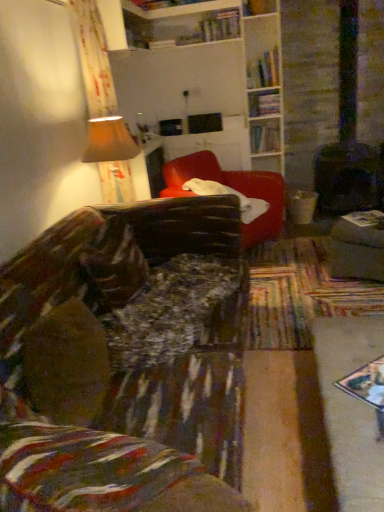
Describe the element at coordinates (264, 103) in the screenshot. I see `wooden bookshelf at upper center, the first shelf viewed from the back` at that location.

The image size is (384, 512). In order to click on hardcover book at upper center, the 2th book in the back-to-front sequence in this screenshot , I will do `click(220, 26)`.

You are a GUI agent. You are given a task and a screenshot of the screen. Output one action in this format:
    pyautogui.click(x=<x>, y=<y>)
    Task: Click on the velvet-like red couch at center, the 1th studio couch when ordered from top to bottom
    The width and height of the screenshot is (384, 512).
    Given the screenshot: What is the action you would take?
    pyautogui.click(x=234, y=189)

Identify the location of velvet-like brown couch at lower left, which ranks as the 1th studio couch in front-to-back order. This screenshot has width=384, height=512. (122, 359).

In order to face wooden bookshelf at upper center, acting as the 2th shelf starting from the back, should I rotate leftwards or rightwards?

It's best to rotate right around 9.214 degrees.

The height and width of the screenshot is (512, 384). What do you see at coordinates (364, 218) in the screenshot?
I see `white paper book at right, the first book when ordered from front to back` at bounding box center [364, 218].

Locate an element on the screen. wooden bookshelf at upper center, the first shelf ordered from the bottom is located at coordinates (264, 103).

Is point (97, 154) closer or farther from the camera than point (367, 213)?

Clearly, point (97, 154) is closer to the camera than point (367, 213).

Does matte beige lampshade at upper left have a lesser height compared to white paper book at right, placed as the 1th book when sorted from bottom to top?

In fact, matte beige lampshade at upper left may be taller than white paper book at right, placed as the 1th book when sorted from bottom to top.

Is matte beige lampshade at upper left located outside white paper book at right, the first book when ordered from front to back?

That's correct, matte beige lampshade at upper left is outside of white paper book at right, the first book when ordered from front to back.

Which object is further away from the camera taking this photo, matte beige lampshade at upper left or white paper book at right, the first book when ordered from right to left?

white paper book at right, the first book when ordered from right to left, is more distant.

From a real-world perspective, does hardcover books at upper right, which is the third book in right-to-left order, sit lower than velvet-like red couch at center, the second studio couch positioned from the bottom?

Incorrect, from a real-world perspective, hardcover books at upper right, which is the third book in right-to-left order, is higher than velvet-like red couch at center, the second studio couch positioned from the bottom.

Choose the correct answer: Is hardcover books at upper right, the 3th book in the bottom-to-top sequence, inside velvet-like red couch at center, the 1th studio couch when ordered from top to bottom, or outside it?

hardcover books at upper right, the 3th book in the bottom-to-top sequence, cannot be found inside velvet-like red couch at center, the 1th studio couch when ordered from top to bottom.

Starting from the velvet-like red couch at center, placed as the 2th studio couch when sorted from front to back, which book is the 1st one behind? Please provide its 2D coordinates.

[(264, 70)]

Could you tell me if hardcover books at upper right, which is counted as the 2th book, starting from the front, is turned towards velvet-like red couch at center, the 1th studio couch when ordered from top to bottom?

No, hardcover books at upper right, which is counted as the 2th book, starting from the front, is not aimed at velvet-like red couch at center, the 1th studio couch when ordered from top to bottom.

Who is smaller, wooden bookshelf at upper center, which is the first shelf in front-to-back order, or matte beige lampshade at upper left?

wooden bookshelf at upper center, which is the first shelf in front-to-back order, is smaller.

From a real-world perspective, which object stands above the other?

From a 3D spatial view, wooden bookshelf at upper center, which is the first shelf in front-to-back order, is above.

From the image's perspective, who appears lower, wooden bookshelf at upper center, which is the first shelf in front-to-back order, or matte beige lampshade at upper left?

matte beige lampshade at upper left appears lower in the image.

Is wooden bookshelf at upper center, arranged as the first shelf when viewed from the top, far away from matte beige lampshade at upper left?

That's right, there is a large distance between wooden bookshelf at upper center, arranged as the first shelf when viewed from the top, and matte beige lampshade at upper left.

Is velvet-like red couch at center, the second studio couch positioned from the bottom, positioned before wooden bookshelf at upper center, the first shelf ordered from the bottom?

Yes, the depth of velvet-like red couch at center, the second studio couch positioned from the bottom, is less than that of wooden bookshelf at upper center, the first shelf ordered from the bottom.

From the image's perspective, relative to wooden bookshelf at upper center, which ranks as the second shelf in top-to-bottom order, is velvet-like red couch at center, placed as the 2th studio couch when sorted from front to back, above or below?

From the image's perspective, velvet-like red couch at center, placed as the 2th studio couch when sorted from front to back, appears below wooden bookshelf at upper center, which ranks as the second shelf in top-to-bottom order.

Does velvet-like red couch at center, the second studio couch positioned from the bottom, appear on the left side of wooden bookshelf at upper center, the first shelf viewed from the back?

Yes.

Between velvet-like red couch at center, placed as the 2th studio couch when sorted from front to back, and wooden bookshelf at upper center, the first shelf viewed from the back, which one has more height?

velvet-like red couch at center, placed as the 2th studio couch when sorted from front to back, is taller.

In terms of height, does hardcover book at upper center, acting as the first book starting from the back, look taller or shorter compared to matte gray ottoman at right?

Considering their sizes, hardcover book at upper center, acting as the first book starting from the back, has less height than matte gray ottoman at right.

From a real-world perspective, who is located lower, hardcover book at upper center, the fourth book viewed from the front, or matte gray ottoman at right?

matte gray ottoman at right, from a real-world perspective.

Is matte gray ottoman at right inside hardcover book at upper center, which is the 2th book in bottom-to-top order?

No, matte gray ottoman at right is located outside of hardcover book at upper center, which is the 2th book in bottom-to-top order.

Locate an element on the screen. This screenshot has width=384, height=512. gray directly beneath the hardcover book at upper center, acting as the first book starting from the back (from a real-world perspective) is located at coordinates (356, 251).

From the wooden bookshelf at upper center, the first shelf ordered from the bottom, count the 1st book to the left and point to it. Please provide its 2D coordinates.

[(264, 70)]

From the image's perspective, which one is positioned higher, wooden bookshelf at upper center, the first shelf viewed from the back, or hardcover books at upper right, which is counted as the 2th book, starting from the front?

hardcover books at upper right, which is counted as the 2th book, starting from the front, from the image's perspective.

Considering the sizes of objects wooden bookshelf at upper center, the first shelf viewed from the back, and hardcover books at upper right, the 3th book in the bottom-to-top sequence, in the image provided, who is bigger, wooden bookshelf at upper center, the first shelf viewed from the back, or hardcover books at upper right, the 3th book in the bottom-to-top sequence,?

hardcover books at upper right, the 3th book in the bottom-to-top sequence, is bigger.

Between point (215, 35) and point (276, 151), which one is positioned behind?

Point (276, 151)

There is a hardcover book at upper center, acting as the first book starting from the back. Where is `the 2nd book above it (from the image's perspective)`? The height and width of the screenshot is (512, 384). the 2nd book above it (from the image's perspective) is located at coordinates (220, 26).

Which of these two, hardcover book at upper center, placed as the 1th book when sorted from top to bottom, or hardcover book at upper center, acting as the first book starting from the back, stands taller?

hardcover book at upper center, acting as the first book starting from the back.

From the image's perspective, which one is positioned higher, hardcover book at upper center, arranged as the fourth book when viewed from the right, or hardcover book at upper center, positioned as the 2th book in right-to-left order?

hardcover book at upper center, arranged as the fourth book when viewed from the right, is shown above in the image.

Find the location of `lamp above the white paper book at right, which is the 4th book from top to bottom (from the image's perspective)`. lamp above the white paper book at right, which is the 4th book from top to bottom (from the image's perspective) is located at coordinates (112, 156).

From a real-world perspective, count 2nd books upward from the velvet-like red couch at center, the second studio couch positioned from the bottom, and point to it. Please provide its 2D coordinates.

[(264, 70)]

From the image, which object appears to be nearer to wooden bookshelf at upper center, arranged as the first shelf when viewed from the top, wooden bookshelf at upper center, which ranks as the second shelf in top-to-bottom order, or hardcover books at upper right, which is counted as the 3th book, starting from the back?

hardcover books at upper right, which is counted as the 3th book, starting from the back.

Considering their positions, is hardcover book at upper center, placed as the 1th book when sorted from top to bottom, positioned closer to wooden bookshelf at upper center, acting as the 2th shelf starting from the back, than wooden bookshelf at upper center, marked as the 2th shelf in a front-to-back arrangement?

Based on the image, hardcover book at upper center, placed as the 1th book when sorted from top to bottom, appears to be nearer to wooden bookshelf at upper center, acting as the 2th shelf starting from the back.

When comparing their distances from hardcover book at upper center, the 2th book in the back-to-front sequence, does matte gray ottoman at right or hardcover book at upper center, positioned as the 2th book in right-to-left order, seem further?

matte gray ottoman at right.

Consider the image. Based on their spatial positions, is hardcover books at upper right, which is counted as the 2th book, starting from the front, or wooden bookshelf at upper center, acting as the 2th shelf starting from the back, closer to velvet-like brown couch at lower left, the second studio couch positioned from the back?

Among the two, hardcover books at upper right, which is counted as the 2th book, starting from the front, is located nearer to velvet-like brown couch at lower left, the second studio couch positioned from the back.

Estimate the real-world distances between objects in this image. Which object is closer to matte beige lampshade at upper left, hardcover book at upper center, acting as the first book starting from the back, or wooden bookshelf at upper center, which ranks as the second shelf in top-to-bottom order?

wooden bookshelf at upper center, which ranks as the second shelf in top-to-bottom order, is closer to matte beige lampshade at upper left.

Based on their spatial positions, is velvet-like red couch at center, the second studio couch positioned from the bottom, or hardcover books at upper right, which is counted as the 3th book, starting from the back, further from wooden bookshelf at upper center, which ranks as the second shelf in top-to-bottom order?

velvet-like red couch at center, the second studio couch positioned from the bottom, is further to wooden bookshelf at upper center, which ranks as the second shelf in top-to-bottom order.

Considering their positions, is velvet-like red couch at center, the second studio couch positioned from the bottom, positioned further to hardcover book at upper center, placed as the 1th book when sorted from top to bottom, than matte beige lampshade at upper left?

The object further to hardcover book at upper center, placed as the 1th book when sorted from top to bottom, is matte beige lampshade at upper left.

When comparing their distances from hardcover book at upper center, placed as the 1th book when sorted from top to bottom, does matte gray ottoman at right or velvet-like brown couch at lower left, the second studio couch positioned from the back, seem closer?

matte gray ottoman at right is positioned closer to the anchor hardcover book at upper center, placed as the 1th book when sorted from top to bottom.

The width and height of the screenshot is (384, 512). Find the location of `studio couch between white paper book at right, which is the 4th book from top to bottom, and hardcover book at upper center, positioned as the 2th book in right-to-left order, along the z-axis`. studio couch between white paper book at right, which is the 4th book from top to bottom, and hardcover book at upper center, positioned as the 2th book in right-to-left order, along the z-axis is located at coordinates (234, 189).

Where is `studio couch that lies between hardcover book at upper center, arranged as the fourth book when viewed from the right, and matte gray ottoman at right from top to bottom`? studio couch that lies between hardcover book at upper center, arranged as the fourth book when viewed from the right, and matte gray ottoman at right from top to bottom is located at coordinates (234, 189).

Locate an element on the screen. The height and width of the screenshot is (512, 384). shelf between hardcover book at upper center, marked as the first book in a left-to-right arrangement, and hardcover book at upper center, the fourth book viewed from the front, in the vertical direction is located at coordinates (264, 103).

Find the location of `lamp between wooden bookshelf at upper center, positioned as the second shelf in bottom-to-top order, and matte gray ottoman at right in the up-down direction`. lamp between wooden bookshelf at upper center, positioned as the second shelf in bottom-to-top order, and matte gray ottoman at right in the up-down direction is located at coordinates (112, 156).